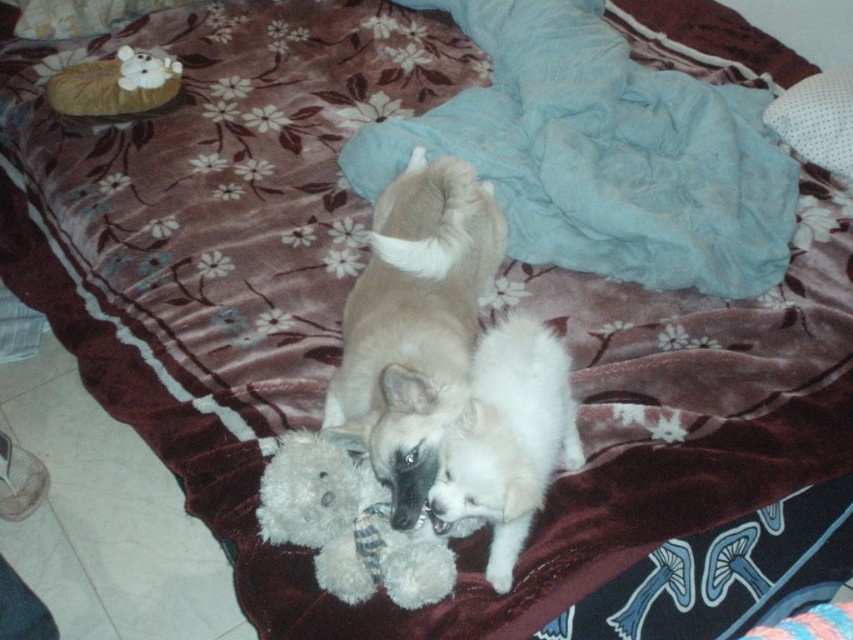
Question: Does white fluffy dog at center appear on the right side of fluffy beige pillow at upper left?

Choices:
 (A) no
 (B) yes

Answer: (B)

Question: Which is farther from the fluffy beige pillow at upper left?

Choices:
 (A) white fluffy dog at center
 (B) white plush bear at upper left
 (C) white plush teddy bear at center
 (D) white dotted pillow at upper right

Answer: (D)

Question: Which point appears farthest from the camera in this image?

Choices:
 (A) (177, 61)
 (B) (376, 312)
 (C) (281, 476)
 (D) (497, 365)

Answer: (A)

Question: Can you confirm if white dotted pillow at upper right is positioned below fluffy beige pillow at upper left?

Choices:
 (A) no
 (B) yes

Answer: (B)

Question: Does white dotted pillow at upper right have a smaller size compared to white plush bear at upper left?

Choices:
 (A) no
 (B) yes

Answer: (A)

Question: Among these points, which one is nearest to the camera?

Choices:
 (A) (817, 116)
 (B) (538, 369)
 (C) (144, 83)

Answer: (B)